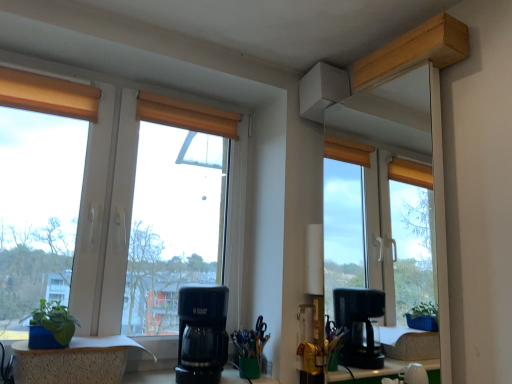
At what (x,y) coordinates should I click in order to perform the action: click on vacant space underneath green felt houseplant at lower left (from a real-world perspective). Please return your answer as a coordinate pair (x, y). The image size is (512, 384). Looking at the image, I should click on (44, 346).